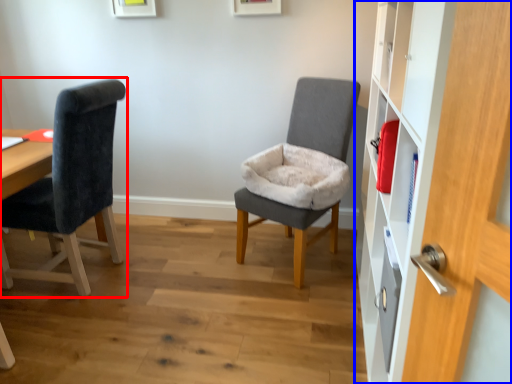
Question: Which of the following is the farthest to the observer, chair (highlighted by a red box) or dresser (highlighted by a blue box)?

Choices:
 (A) chair
 (B) dresser

Answer: (A)